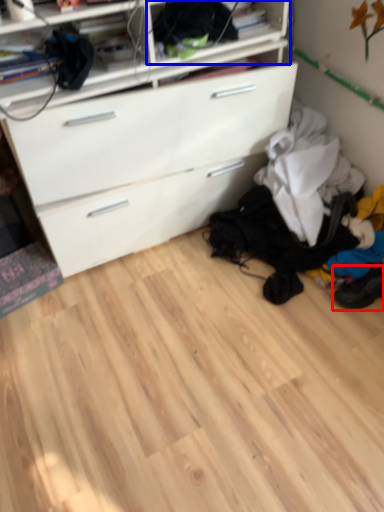
Question: Which object is further to the camera taking this photo, footwear (highlighted by a red box) or shelf (highlighted by a blue box)?

Choices:
 (A) footwear
 (B) shelf

Answer: (A)